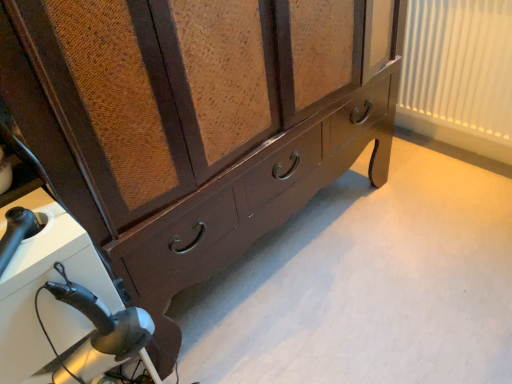
The image size is (512, 384). What do you see at coordinates (459, 66) in the screenshot?
I see `white pleated curtain at upper right` at bounding box center [459, 66].

Locate an element on the screen. white pleated curtain at upper right is located at coordinates (459, 66).

In order to face black plastic hairdryer at lower left, should I rotate leftwards or rightwards?

You should look left and rotate roughly 29.519 degrees.

Measure the distance between point (39,347) and camera.

30.43 inches.

Describe the element at coordinates (62, 304) in the screenshot. I see `black plastic hairdryer at lower left` at that location.

Identify the location of black plastic hairdryer at lower left. Image resolution: width=512 pixels, height=384 pixels. (62, 304).

You are a GUI agent. You are given a task and a screenshot of the screen. Output one action in this format:
    pyautogui.click(x=<x>, y=<y>)
    Task: Click on the white pleated curtain at upper right
    
    Given the screenshot: What is the action you would take?
    pyautogui.click(x=459, y=66)

From the picture: Considering the positions of objects white pleated curtain at upper right and black plastic hairdryer at lower left in the image provided, who is more to the right, white pleated curtain at upper right or black plastic hairdryer at lower left?

white pleated curtain at upper right.

From the picture: Is the position of white pleated curtain at upper right more distant than that of black plastic hairdryer at lower left?

Yes, it is behind black plastic hairdryer at lower left.

Is point (416, 90) closer to viewer compared to point (49, 210)?

No, (416, 90) is behind (49, 210).

From the image's perspective, which one is positioned lower, white pleated curtain at upper right or black plastic hairdryer at lower left?

From the image's view, black plastic hairdryer at lower left is below.

From a real-world perspective, between white pleated curtain at upper right and black plastic hairdryer at lower left, who is vertically lower?

In real-world perspective, black plastic hairdryer at lower left is lower.

Between white pleated curtain at upper right and black plastic hairdryer at lower left, which one has larger width?

black plastic hairdryer at lower left is wider.

Considering the relative sizes of white pleated curtain at upper right and black plastic hairdryer at lower left in the image provided, is white pleated curtain at upper right taller than black plastic hairdryer at lower left?

In fact, white pleated curtain at upper right may be shorter than black plastic hairdryer at lower left.

In terms of size, does white pleated curtain at upper right appear bigger or smaller than black plastic hairdryer at lower left?

Clearly, white pleated curtain at upper right is smaller in size than black plastic hairdryer at lower left.

Is white pleated curtain at upper right outside of black plastic hairdryer at lower left?

Yes.

Does white pleated curtain at upper right touch black plastic hairdryer at lower left?

No, white pleated curtain at upper right is not in contact with black plastic hairdryer at lower left.

Is white pleated curtain at upper right facing towards black plastic hairdryer at lower left?

Yes, white pleated curtain at upper right is oriented towards black plastic hairdryer at lower left.

Can you tell me how much white pleated curtain at upper right and black plastic hairdryer at lower left differ in facing direction?

1.25 degrees.

Identify the location of appliance in front of the white pleated curtain at upper right. (62, 304).

Which is more to the left, black plastic hairdryer at lower left or white pleated curtain at upper right?

Positioned to the left is black plastic hairdryer at lower left.

Which object is further away from the camera taking this photo, black plastic hairdryer at lower left or white pleated curtain at upper right?

Positioned behind is white pleated curtain at upper right.

Is point (4, 300) closer or farther from the camera than point (489, 44)?

Clearly, point (4, 300) is closer to the camera than point (489, 44).

From the image's perspective, which is below, black plastic hairdryer at lower left or white pleated curtain at upper right?

black plastic hairdryer at lower left appears lower in the image.

Based on the photo, from a real-world perspective, which object rests below the other?

black plastic hairdryer at lower left, from a real-world perspective.

Which object is thinner, black plastic hairdryer at lower left or white pleated curtain at upper right?

With smaller width is white pleated curtain at upper right.

Looking at this image, can you confirm if black plastic hairdryer at lower left is taller than white pleated curtain at upper right?

Yes, black plastic hairdryer at lower left is taller than white pleated curtain at upper right.

In terms of size, does black plastic hairdryer at lower left appear bigger or smaller than white pleated curtain at upper right?

black plastic hairdryer at lower left is bigger than white pleated curtain at upper right.

Is white pleated curtain at upper right surrounded by black plastic hairdryer at lower left?

No, white pleated curtain at upper right is not surrounded by black plastic hairdryer at lower left.

Is black plastic hairdryer at lower left with white pleated curtain at upper right?

They are not placed beside each other.

Could you tell me if black plastic hairdryer at lower left is turned towards white pleated curtain at upper right?

No, black plastic hairdryer at lower left is not oriented towards white pleated curtain at upper right.

What's the angular difference between black plastic hairdryer at lower left and white pleated curtain at upper right's facing directions?

The facing directions of black plastic hairdryer at lower left and white pleated curtain at upper right are 1.25 degrees apart.

How much distance is there between black plastic hairdryer at lower left and white pleated curtain at upper right?

black plastic hairdryer at lower left and white pleated curtain at upper right are 5.17 feet apart.

Where is `curtain above the black plastic hairdryer at lower left (from a real-world perspective)`? curtain above the black plastic hairdryer at lower left (from a real-world perspective) is located at coordinates (459, 66).

Locate an element on the screen. curtain that appears behind the black plastic hairdryer at lower left is located at coordinates (459, 66).

Find the location of a particular element. The width and height of the screenshot is (512, 384). curtain that is above the black plastic hairdryer at lower left (from the image's perspective) is located at coordinates (459, 66).